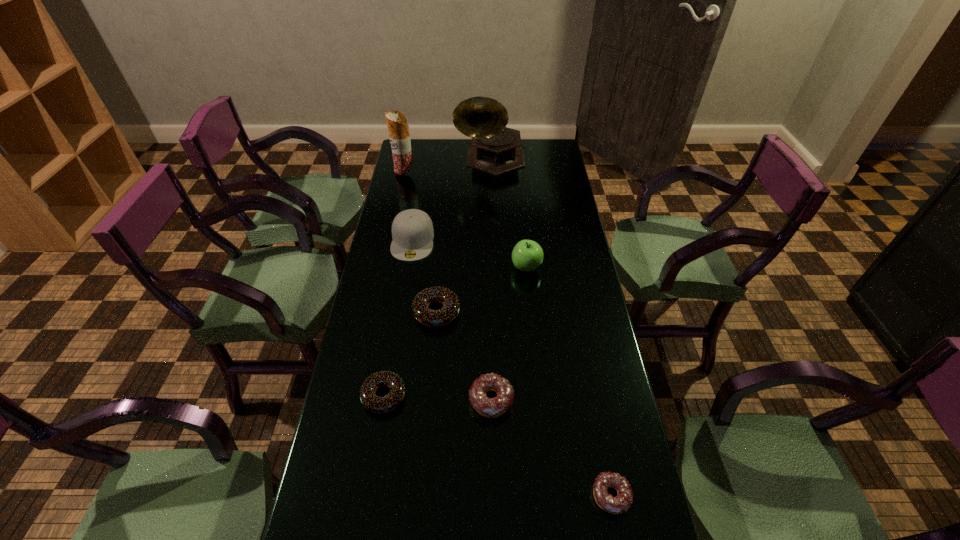
The image size is (960, 540). I want to click on the smaller chocolate doughnut, so click(373, 403).

At what (x,y) coordinates should I click in order to perform the action: click on the nearest doughnut. Please return your answer as a coordinate pair (x, y). This screenshot has height=540, width=960. Looking at the image, I should click on (621, 503).

Identify the location of the rightmost doughnut. (621, 503).

The image size is (960, 540). Find the location of `free space located on the horn direction of the phonograph record`. free space located on the horn direction of the phonograph record is located at coordinates (492, 204).

What are the coordinates of `free space located on the right of the burrito` in the screenshot? It's located at coord(430,174).

This screenshot has height=540, width=960. What are the coordinates of `free region located 0.160m on the left of the green apple` in the screenshot? It's located at (466, 268).

Where is `vacant region located on the front-facing side of the cap`? The image size is (960, 540). vacant region located on the front-facing side of the cap is located at coordinates (406, 280).

You are a GUI agent. You are given a task and a screenshot of the screen. Output one action in this format:
    pyautogui.click(x=<x>, y=<y>)
    Task: Click on the vacant space located 0.110m on the right of the bigger pink doughnut
    
    Given the screenshot: What is the action you would take?
    pyautogui.click(x=554, y=400)

Identify the location of vacant region located 0.140m on the front of the farthest doughnut. The width and height of the screenshot is (960, 540). (431, 371).

Where is `vacant position located 0.050m on the back of the smaller chocolate doughnut`? This screenshot has height=540, width=960. vacant position located 0.050m on the back of the smaller chocolate doughnut is located at coordinates (390, 362).